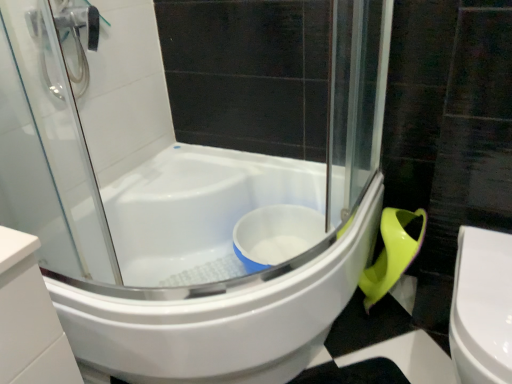
Where is `white glossy bathtub at center`? The height and width of the screenshot is (384, 512). white glossy bathtub at center is located at coordinates (213, 271).

What do you see at coordinates (213, 271) in the screenshot? The height and width of the screenshot is (384, 512). I see `white glossy bathtub at center` at bounding box center [213, 271].

What is the approximate width of white glossy bathtub at center?

white glossy bathtub at center is 36.14 inches wide.

This screenshot has height=384, width=512. I want to click on white glossy toilet at lower right, so click(482, 307).

What do you see at coordinates (482, 307) in the screenshot?
I see `white glossy toilet at lower right` at bounding box center [482, 307].

In order to click on white glossy bathtub at center in this screenshot , I will do click(213, 271).

Consider the image. Based on their positions, is white glossy bathtub at center located to the left or right of white glossy toilet at lower right?

From the image, it's evident that white glossy bathtub at center is to the left of white glossy toilet at lower right.

Which object is further away from the camera, white glossy bathtub at center or white glossy toilet at lower right?

white glossy bathtub at center is behind.

Is point (145, 271) closer to camera compared to point (497, 289)?

No, it is not.

From the image's perspective, is white glossy bathtub at center under white glossy toilet at lower right?

No.

From a real-world perspective, which is physically above, white glossy bathtub at center or white glossy toilet at lower right?

In real-world perspective, white glossy toilet at lower right is above.

Considering the relative sizes of white glossy bathtub at center and white glossy toilet at lower right in the image provided, is white glossy bathtub at center wider than white glossy toilet at lower right?

Correct, the width of white glossy bathtub at center exceeds that of white glossy toilet at lower right.

Who is shorter, white glossy bathtub at center or white glossy toilet at lower right?

With less height is white glossy bathtub at center.

Is white glossy bathtub at center bigger or smaller than white glossy toilet at lower right?

Considering their sizes, white glossy bathtub at center takes up more space than white glossy toilet at lower right.

Is white glossy bathtub at center positioned beyond the bounds of white glossy toilet at lower right?

white glossy bathtub at center is positioned outside white glossy toilet at lower right.

Is white glossy bathtub at center positioned far away from white glossy toilet at lower right?

They are positioned close to each other.

Is white glossy toilet at lower right at the back of white glossy bathtub at center?

No, white glossy bathtub at center's orientation is not away from white glossy toilet at lower right.

What's the angular difference between white glossy bathtub at center and white glossy toilet at lower right's facing directions?

They differ by 0.459 degrees in their facing directions.

How much distance is there between white glossy bathtub at center and white glossy toilet at lower right?

23.28 inches.

Locate an element on the screen. The width and height of the screenshot is (512, 384). toilet above the white glossy bathtub at center (from a real-world perspective) is located at coordinates (482, 307).

Between white glossy toilet at lower right and white glossy bathtub at center, which one appears on the left side from the viewer's perspective?

Positioned to the left is white glossy bathtub at center.

Is white glossy toilet at lower right positioned before white glossy bathtub at center?

Yes.

Is point (469, 327) more distant than point (308, 258)?

No, (469, 327) is in front of (308, 258).

From the image's perspective, which is below, white glossy toilet at lower right or white glossy bathtub at center?

white glossy toilet at lower right, from the image's perspective.

From a real-world perspective, is white glossy toilet at lower right physically located above or below white glossy bathtub at center?

Clearly, from a real-world perspective, white glossy toilet at lower right is above white glossy bathtub at center.

Considering the relative sizes of white glossy toilet at lower right and white glossy bathtub at center in the image provided, is white glossy toilet at lower right wider than white glossy bathtub at center?

No, white glossy toilet at lower right is not wider than white glossy bathtub at center.

Is white glossy toilet at lower right taller than white glossy bathtub at center?

Indeed, white glossy toilet at lower right has a greater height compared to white glossy bathtub at center.

Considering the relative sizes of white glossy toilet at lower right and white glossy bathtub at center in the image provided, is white glossy toilet at lower right bigger than white glossy bathtub at center?

Actually, white glossy toilet at lower right might be smaller than white glossy bathtub at center.

Could white glossy bathtub at center be considered to be inside white glossy toilet at lower right?

Definitely not — white glossy bathtub at center is not inside white glossy toilet at lower right.

Looking at this image, is white glossy toilet at lower right far from white glossy bathtub at center?

white glossy toilet at lower right is actually quite close to white glossy bathtub at center.

Is white glossy toilet at lower right positioned with its back to white glossy bathtub at center?

No, white glossy toilet at lower right is not facing away from white glossy bathtub at center.

What's the angular difference between white glossy toilet at lower right and white glossy bathtub at center's facing directions?

0.459 degrees separate the facing orientations of white glossy toilet at lower right and white glossy bathtub at center.

Looking at this image, measure the distance between white glossy toilet at lower right and white glossy bathtub at center.

They are 23.28 inches apart.

The width and height of the screenshot is (512, 384). I want to click on bathtub located above the white glossy toilet at lower right (from the image's perspective), so click(x=213, y=271).

Locate an element on the screen. Image resolution: width=512 pixels, height=384 pixels. toilet on the right of white glossy bathtub at center is located at coordinates (482, 307).

Identify the location of bathtub behind the white glossy toilet at lower right. This screenshot has width=512, height=384. (213, 271).